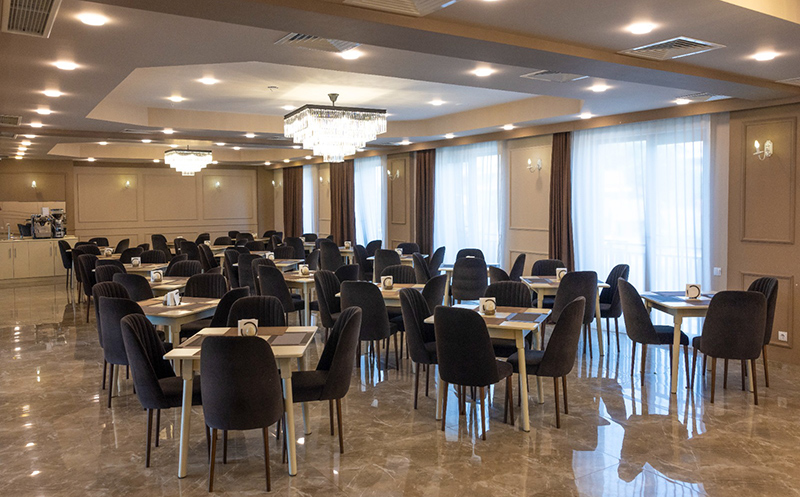
Image resolution: width=800 pixels, height=497 pixels. I want to click on dark curtains, so click(564, 192), click(428, 183), click(348, 181), click(340, 196), click(302, 189), click(292, 188).